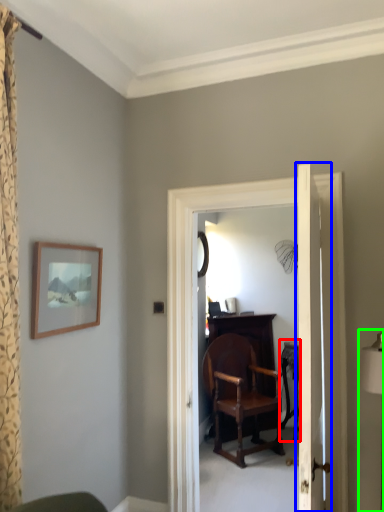
Question: Which object is the farthest from table (highlighted by a red box)? Choose among these: door (highlighted by a blue box) or table lamp (highlighted by a green box).

Choices:
 (A) door
 (B) table lamp

Answer: (A)